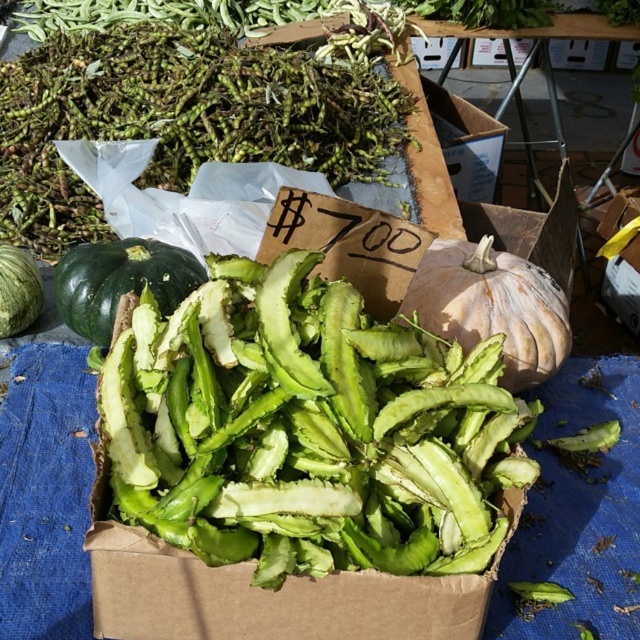
You are a customer at the market stall and want to know which item is taller between the green matte string beans at center and the green matte pumpkin at left. Can you tell me?

The green matte string beans at center has a greater height compared to the green matte pumpkin at left, so the green matte string beans at center is taller.

You are a customer at the market stall looking at the green rough string beans at upper left and the speckled white pumpkin at center. Which of these two items is positioned higher on the table?

The green rough string beans at upper left is positioned higher on the table than the speckled white pumpkin at center.

You are a customer at the market stall. You want to buy a pumpkin for a recipe that requires a larger pumpkin. Which pumpkin between the speckled white pumpkin at center and the green matte pumpkin at left should you choose?

The speckled white pumpkin at center is larger in size compared to the green matte pumpkin at left, so you should choose the speckled white pumpkin at center for your recipe.